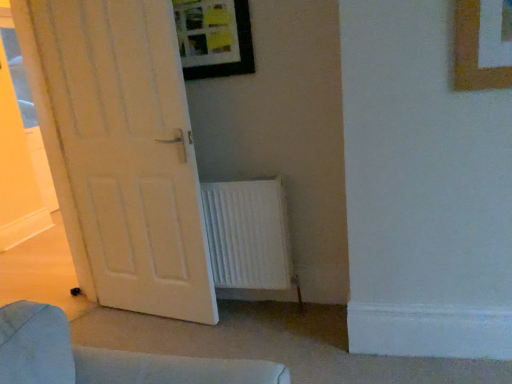
Question: Is white textured radiator at lower center thinner than white matte door at left?

Choices:
 (A) no
 (B) yes

Answer: (A)

Question: From the image's perspective, is white textured radiator at lower center above white matte door at left?

Choices:
 (A) yes
 (B) no

Answer: (B)

Question: Can you confirm if white textured radiator at lower center is bigger than white matte door at left?

Choices:
 (A) yes
 (B) no

Answer: (B)

Question: From a real-world perspective, is white textured radiator at lower center positioned over white matte door at left based on gravity?

Choices:
 (A) yes
 (B) no

Answer: (B)

Question: Would you say white textured radiator at lower center is a long distance from white matte door at left?

Choices:
 (A) yes
 (B) no

Answer: (B)

Question: Is wooden-framed picture at upper center bigger or smaller than white textured radiator at lower center?

Choices:
 (A) big
 (B) small

Answer: (B)

Question: Is wooden-framed picture at upper center wider or thinner than white textured radiator at lower center?

Choices:
 (A) thin
 (B) wide

Answer: (A)

Question: In the image, is wooden-framed picture at upper center positioned in front of or behind white textured radiator at lower center?

Choices:
 (A) front
 (B) behind

Answer: (A)

Question: Which is correct: wooden-framed picture at upper center is inside white textured radiator at lower center, or outside of it?

Choices:
 (A) inside
 (B) outside

Answer: (B)

Question: Does point (204, 16) appear closer or farther from the camera than point (157, 312)?

Choices:
 (A) farther
 (B) closer

Answer: (B)

Question: In terms of width, does wooden-framed picture at upper center look wider or thinner when compared to white matte door at left?

Choices:
 (A) wide
 (B) thin

Answer: (B)

Question: Is wooden-framed picture at upper center spatially inside white matte door at left, or outside of it?

Choices:
 (A) inside
 (B) outside

Answer: (B)

Question: In the image, is wooden-framed picture at upper center positioned in front of or behind white matte door at left?

Choices:
 (A) front
 (B) behind

Answer: (B)

Question: From a real-world perspective, is white textured radiator at lower center positioned above or below white matte door at left?

Choices:
 (A) below
 (B) above

Answer: (A)

Question: Is point (264, 263) positioned closer to the camera than point (135, 147)?

Choices:
 (A) closer
 (B) farther

Answer: (B)